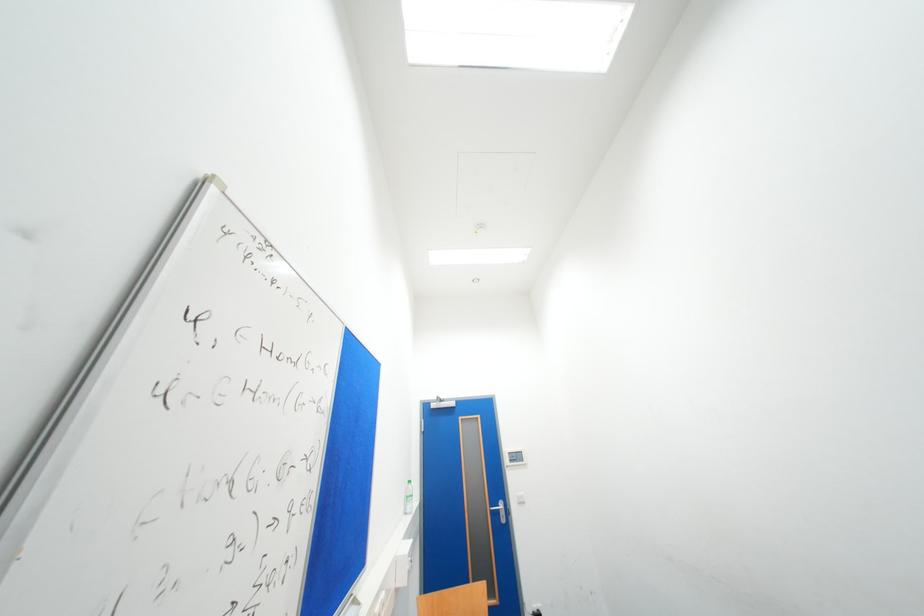
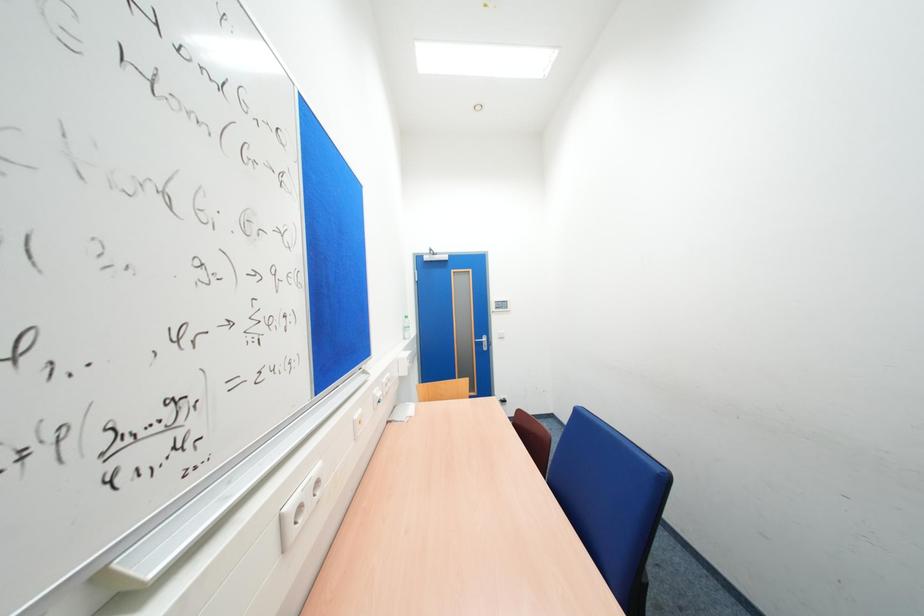
Question: What movement of the cameraman would produce the second image?

Choices:
 (A) Left
 (B) Right
 (C) Forward
 (D) Backward

Answer: (C)